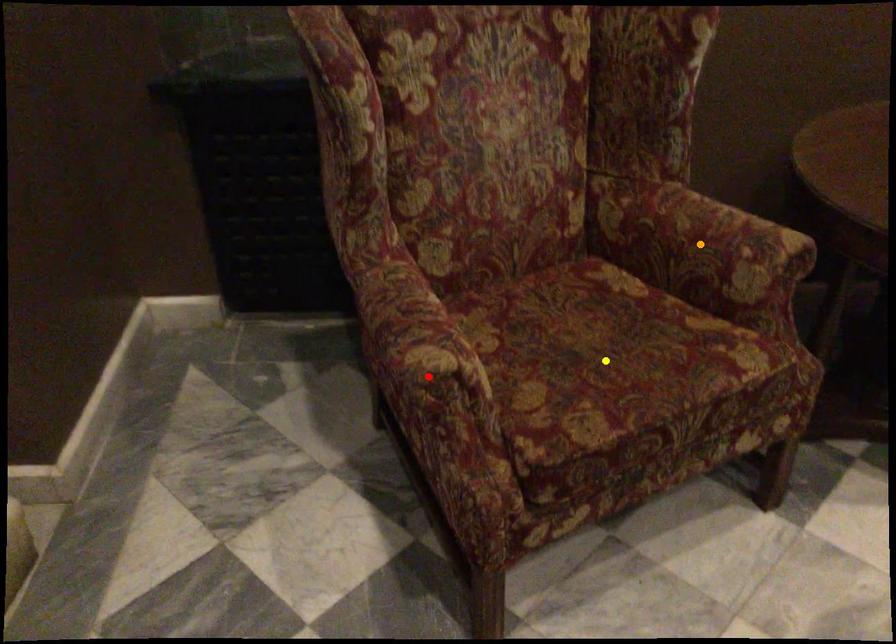
Order these from nearest to farthest:
red point
orange point
yellow point

red point, yellow point, orange point